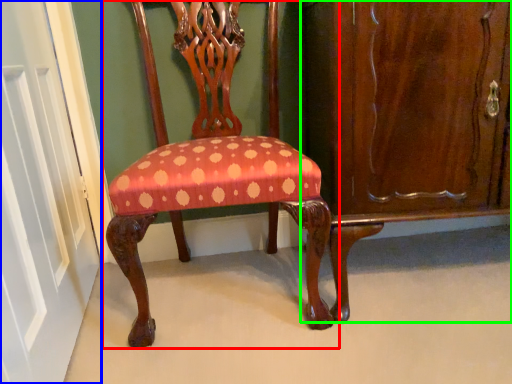
Question: Which object is the closest to the chair (highlighted by a red box)? Choose among these: door (highlighted by a blue box) or dresser (highlighted by a green box).

Choices:
 (A) door
 (B) dresser

Answer: (B)